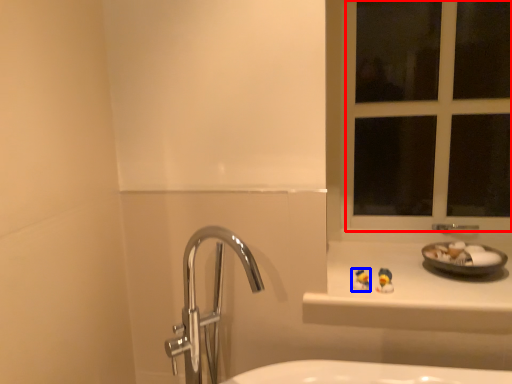
Question: Which point is further to the camera, window frame (highlighted by a red box) or miniature (highlighted by a blue box)?

Choices:
 (A) window frame
 (B) miniature

Answer: (A)